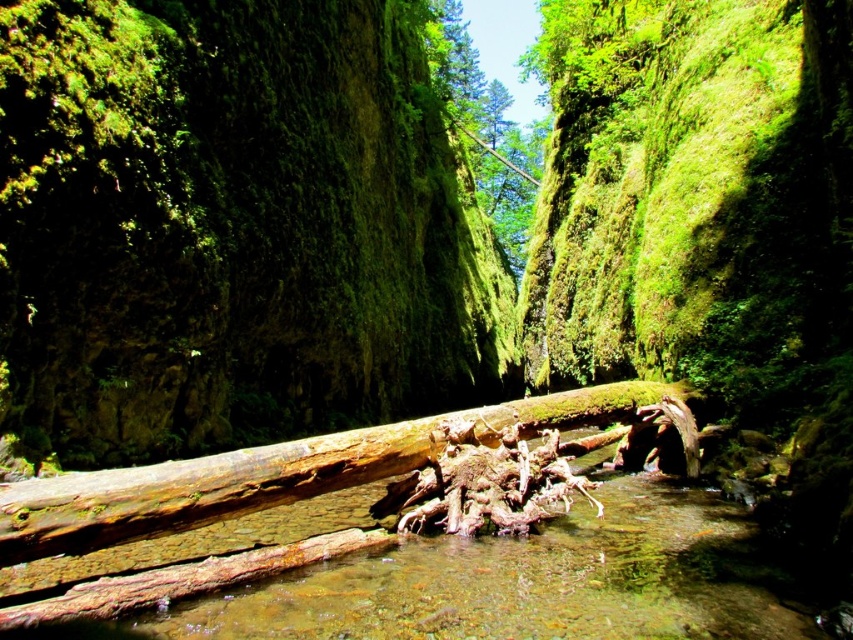
Does smooth brown log at center appear on the right side of green mossy tree at center?

Incorrect, smooth brown log at center is not on the right side of green mossy tree at center.

Image resolution: width=853 pixels, height=640 pixels. I want to click on smooth brown log at center, so click(x=270, y=474).